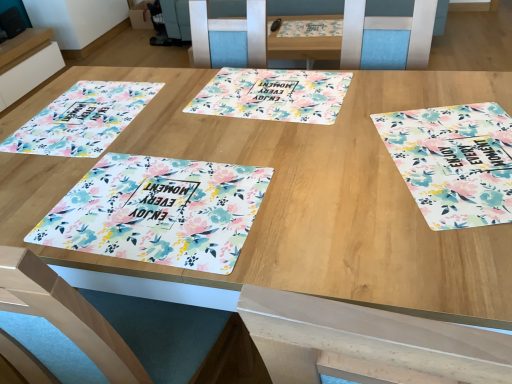
Question: Is floral fabric placemat at right, acting as the first tablecloth starting from the right, bigger or smaller than floral printed placemat at lower left, the second tablecloth when ordered from right to left?

Choices:
 (A) big
 (B) small

Answer: (B)

Question: Would you say floral fabric placemat at right, which is the third tablecloth in left-to-right order, is to the left or to the right of floral printed placemat at lower left, the 2th tablecloth when ordered from left to right, in the picture?

Choices:
 (A) right
 (B) left

Answer: (A)

Question: Which object is positioned farthest from the floral printed placemat at lower left, the 2th tablecloth when ordered from left to right?

Choices:
 (A) floral fabric placemat at right, acting as the first tablecloth starting from the right
 (B) floral printed placemat at center
 (C) floral printed placemat at left, acting as the 1th tablecloth starting from the left
 (D) white glossy placemat at upper left

Answer: (D)

Question: Which object is positioned closest to the floral printed placemat at lower left, the 2th tablecloth when ordered from left to right?

Choices:
 (A) white glossy placemat at upper left
 (B) floral fabric placemat at right, which is the third tablecloth in left-to-right order
 (C) floral printed placemat at center
 (D) floral printed placemat at left, acting as the 1th tablecloth starting from the left

Answer: (D)